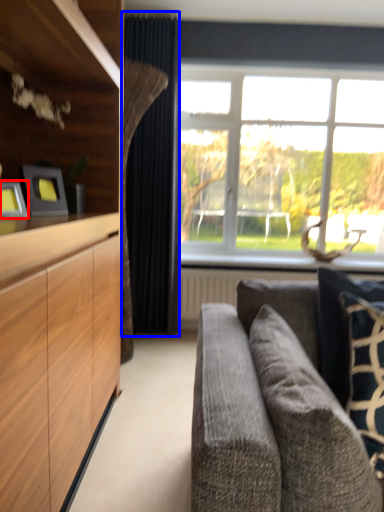
Question: Which of the following is the farthest to the observer, picture frame (highlighted by a red box) or curtain (highlighted by a blue box)?

Choices:
 (A) picture frame
 (B) curtain

Answer: (B)